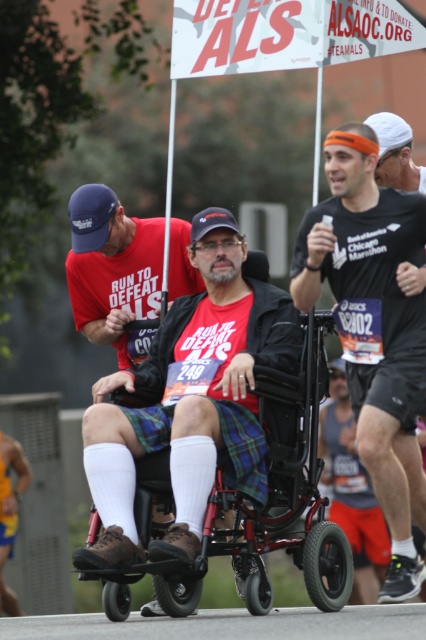
Is point (359, 204) less distant than point (261, 400)?

No.

Is matte black shirt at center thinner than metallic red wheelchair at center?

Yes, matte black shirt at center is thinner than metallic red wheelchair at center.

Does point (382, 257) come farther from viewer compared to point (124, 616)?

Yes, it is behind point (124, 616).

Identify the location of matte black shirt at center. The image size is (426, 640). (374, 326).